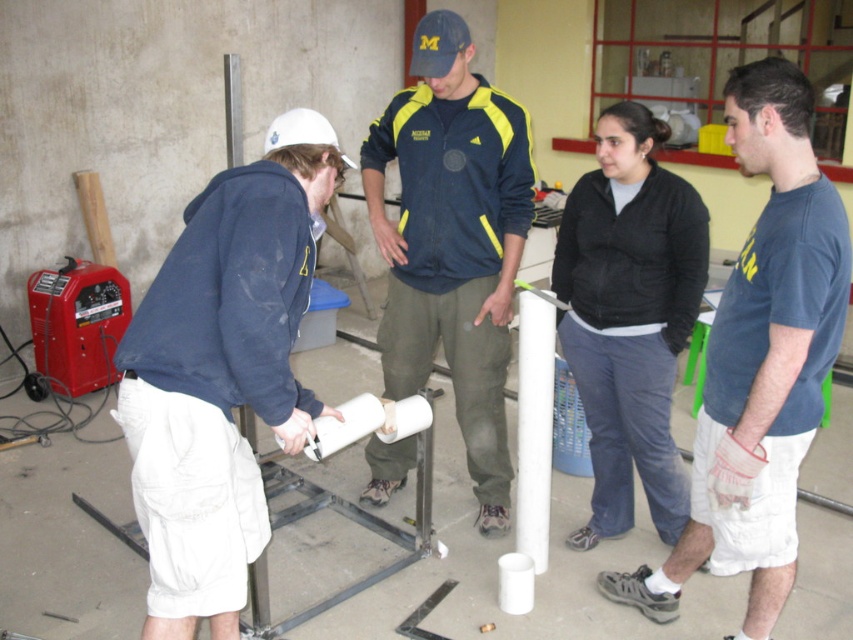
Is white matte hard hat at left to the left of blue fabric jacket at center from the viewer's perspective?

Correct, you'll find white matte hard hat at left to the left of blue fabric jacket at center.

Is white matte hard hat at left to the right of blue fabric jacket at center from the viewer's perspective?

Incorrect, white matte hard hat at left is not on the right side of blue fabric jacket at center.

The image size is (853, 640). What do you see at coordinates (222, 372) in the screenshot?
I see `white matte hard hat at left` at bounding box center [222, 372].

I want to click on white matte hard hat at left, so click(x=222, y=372).

Who is more forward, [270,324] or [598,371]?

Point [270,324]

Can you confirm if white matte hard hat at left is positioned to the left of black cotton shirt at center?

Correct, you'll find white matte hard hat at left to the left of black cotton shirt at center.

Is point (283, 154) in front of point (614, 456)?

Yes, point (283, 154) is closer to viewer.

In order to click on white matte hard hat at left in this screenshot , I will do `click(222, 372)`.

Does white matte hard hat at left appear on the right side of blue cotton t-shirt at upper right?

No, white matte hard hat at left is not to the right of blue cotton t-shirt at upper right.

The height and width of the screenshot is (640, 853). What do you see at coordinates (222, 372) in the screenshot?
I see `white matte hard hat at left` at bounding box center [222, 372].

At what (x,y) coordinates should I click in order to perform the action: click on white matte hard hat at left. Please return your answer as a coordinate pair (x, y). The width and height of the screenshot is (853, 640). Looking at the image, I should click on [222, 372].